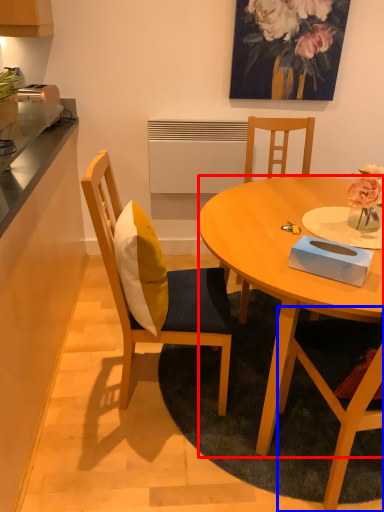
Question: Which of the following is the farthest to the observer, desk (highlighted by a red box) or chair (highlighted by a blue box)?

Choices:
 (A) desk
 (B) chair

Answer: (A)